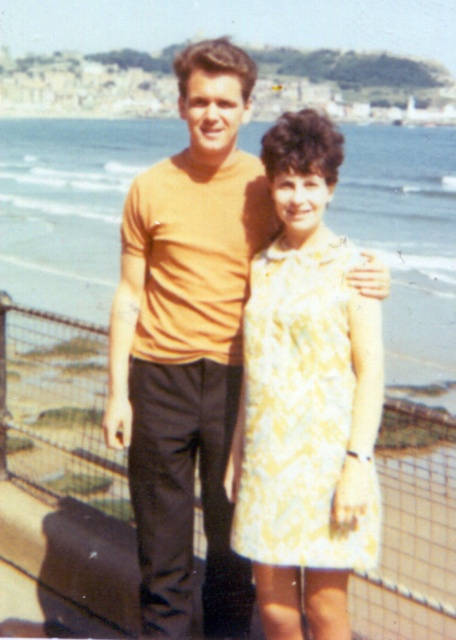
Question: Estimate the real-world distances between objects in this image. Which object is farther from the metal wire fence at center?

Choices:
 (A) yellow floral dress at center
 (B) matte orange t-shirt at center

Answer: (A)

Question: Is matte orange t-shirt at center wider than metal wire fence at center?

Choices:
 (A) yes
 (B) no

Answer: (B)

Question: Does metal wire fence at center have a smaller size compared to yellow floral dress at center?

Choices:
 (A) yes
 (B) no

Answer: (B)

Question: Which of the following is the farthest from the observer?

Choices:
 (A) (274, 484)
 (B) (379, 593)

Answer: (B)

Question: Does metal wire fence at center have a larger size compared to yellow floral dress at center?

Choices:
 (A) no
 (B) yes

Answer: (B)

Question: Which object appears farthest from the camera in this image?

Choices:
 (A) metal wire fence at center
 (B) yellow floral dress at center
 (C) matte orange t-shirt at center

Answer: (C)